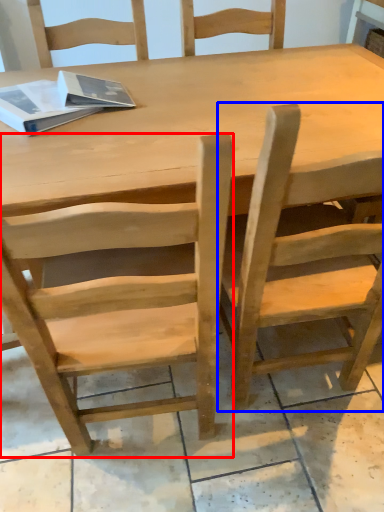
Question: Which object appears farthest to the camera in this image, chair (highlighted by a red box) or chair (highlighted by a blue box)?

Choices:
 (A) chair
 (B) chair

Answer: (B)